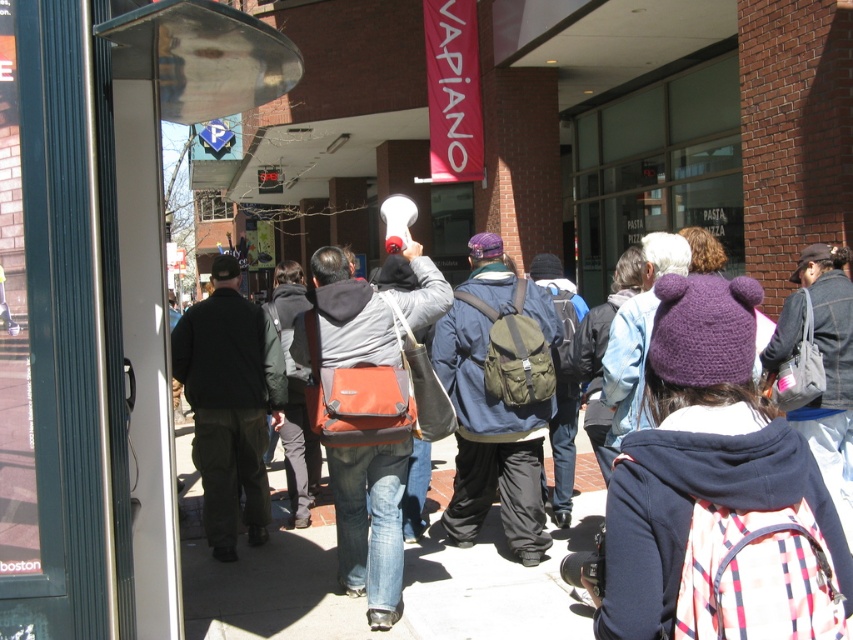
Question: Can you confirm if plaid fabric backpack at center is bigger than matte green backpack at center?

Choices:
 (A) no
 (B) yes

Answer: (A)

Question: Can you confirm if matte green backpack at center is positioned to the right of orange fabric messenger bag at center?

Choices:
 (A) no
 (B) yes

Answer: (B)

Question: Which point is closer to the camera?

Choices:
 (A) matte green backpack at center
 (B) black cotton jacket at center

Answer: (A)

Question: Can you confirm if plaid fabric backpack at center is positioned below orange fabric messenger bag at center?

Choices:
 (A) no
 (B) yes

Answer: (A)

Question: Which point appears farthest from the camera in this image?

Choices:
 (A) (215, 276)
 (B) (635, 436)
 (C) (540, 502)
 (D) (345, 545)

Answer: (A)

Question: Which point is farther to the camera?

Choices:
 (A) (354, 595)
 (B) (505, 464)
 (C) (234, 346)
 (D) (701, 476)

Answer: (C)